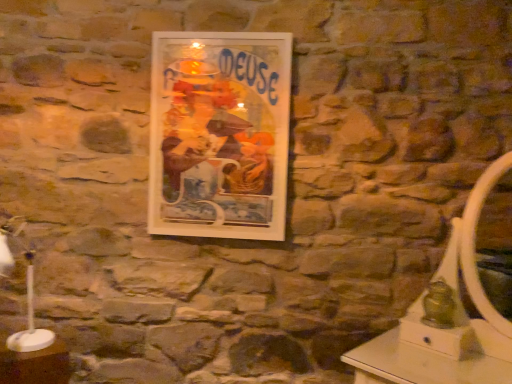
This screenshot has width=512, height=384. What do you see at coordinates (219, 134) in the screenshot?
I see `white glossy picture frame at center` at bounding box center [219, 134].

The height and width of the screenshot is (384, 512). I want to click on white glossy picture frame at center, so click(x=219, y=134).

At what (x,y) coordinates should I click in order to perform the action: click on white glossy picture frame at center. Please return your answer as a coordinate pair (x, y). The image size is (512, 384). Looking at the image, I should click on (219, 134).